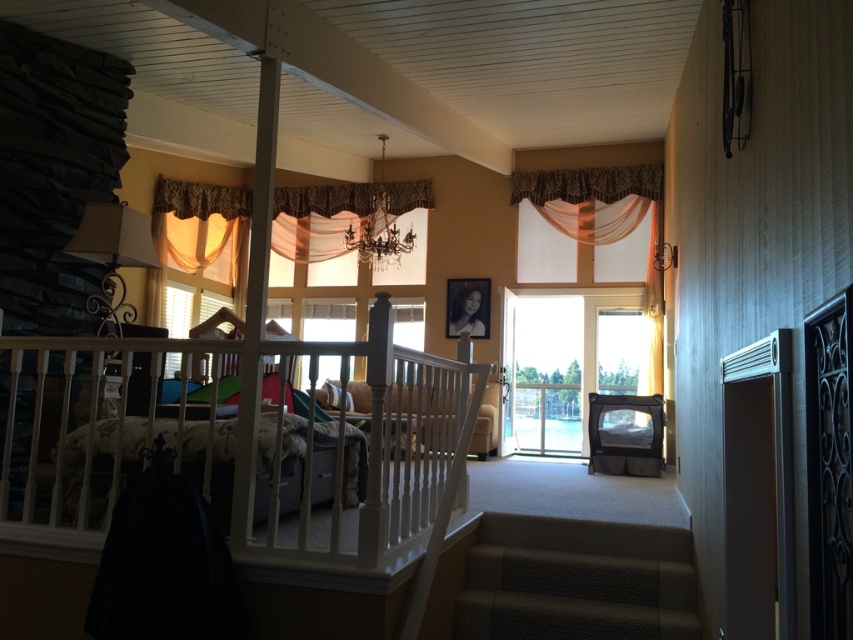
Does point (32, 512) come farther from viewer compared to point (186, 202)?

No.

Is point (305, 456) positioned behind point (291, 202)?

No.

Where is `white wooden porch at lower left`? This screenshot has width=853, height=640. white wooden porch at lower left is located at coordinates (245, 449).

Who is more forward, [660,595] or [532,324]?

Point [660,595]

Is carpeted stairs at lower center bigger than clear glass door at center?

No, carpeted stairs at lower center is not bigger than clear glass door at center.

Who is more distant from viewer, (515, 522) or (525, 323)?

Positioned behind is point (525, 323).

The width and height of the screenshot is (853, 640). What are the coordinates of `carpeted stairs at lower center` in the screenshot? It's located at (576, 580).

Does carpeted stairs at lower center have a greater width compared to sheer orange fabric at upper left?

In fact, carpeted stairs at lower center might be narrower than sheer orange fabric at upper left.

Does point (578, 625) come closer to viewer compared to point (229, 211)?

Yes.

Is point (608, 605) closer to viewer compared to point (181, 209)?

That is True.

In order to click on carpeted stairs at lower center in this screenshot , I will do `click(576, 580)`.